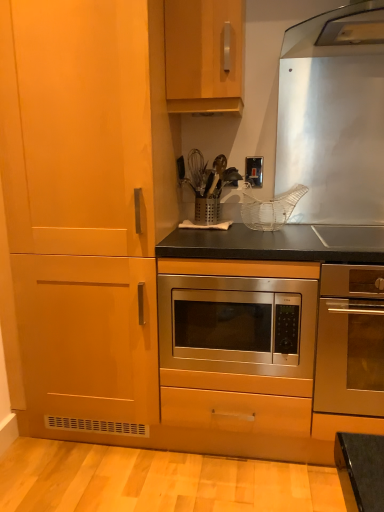
Question: In which direction should I rotate to look at stainless steel oven at center, arranged as the second oven when viewed from the left?

Choices:
 (A) right
 (B) left

Answer: (A)

Question: Is stainless steel microwave at center, which is the 2th oven in right-to-left order, in front of stainless steel oven at center, arranged as the second oven when viewed from the left?

Choices:
 (A) yes
 (B) no

Answer: (B)

Question: Is stainless steel microwave at center, marked as the first oven in a left-to-right arrangement, placed right next to stainless steel oven at center, which is counted as the 1th oven, starting from the right?

Choices:
 (A) no
 (B) yes

Answer: (A)

Question: Considering the relative sizes of stainless steel microwave at center, marked as the first oven in a left-to-right arrangement, and stainless steel oven at center, which is counted as the 1th oven, starting from the right, in the image provided, is stainless steel microwave at center, marked as the first oven in a left-to-right arrangement, wider than stainless steel oven at center, which is counted as the 1th oven, starting from the right,?

Choices:
 (A) yes
 (B) no

Answer: (B)

Question: Is stainless steel microwave at center, which is the 2th oven in right-to-left order, far away from stainless steel oven at center, which is counted as the 1th oven, starting from the right?

Choices:
 (A) yes
 (B) no

Answer: (B)

Question: From the image's perspective, would you say stainless steel microwave at center, marked as the first oven in a left-to-right arrangement, is shown under stainless steel oven at center, which is counted as the 1th oven, starting from the right?

Choices:
 (A) yes
 (B) no

Answer: (B)

Question: From the image's perspective, is stainless steel microwave at center, marked as the first oven in a left-to-right arrangement, above stainless steel oven at center, which is counted as the 1th oven, starting from the right?

Choices:
 (A) no
 (B) yes

Answer: (B)

Question: Can you confirm if satin silver switch at upper center is taller than stainless steel oven at center, arranged as the second oven when viewed from the left?

Choices:
 (A) yes
 (B) no

Answer: (B)

Question: Is stainless steel oven at center, arranged as the second oven when viewed from the left, at the back of satin silver switch at upper center?

Choices:
 (A) no
 (B) yes

Answer: (A)

Question: Is satin silver switch at upper center smaller than stainless steel oven at center, which is counted as the 1th oven, starting from the right?

Choices:
 (A) no
 (B) yes

Answer: (B)

Question: From the image's perspective, is satin silver switch at upper center below stainless steel oven at center, which is counted as the 1th oven, starting from the right?

Choices:
 (A) no
 (B) yes

Answer: (A)

Question: Is satin silver switch at upper center at the left side of stainless steel oven at center, which is counted as the 1th oven, starting from the right?

Choices:
 (A) yes
 (B) no

Answer: (A)

Question: Considering the relative sizes of satin silver switch at upper center and stainless steel oven at center, arranged as the second oven when viewed from the left, in the image provided, is satin silver switch at upper center wider than stainless steel oven at center, arranged as the second oven when viewed from the left,?

Choices:
 (A) yes
 (B) no

Answer: (B)

Question: From a real-world perspective, is satin silver switch at upper center positioned over stainless steel microwave at center, which is the 2th oven in right-to-left order, based on gravity?

Choices:
 (A) yes
 (B) no

Answer: (A)